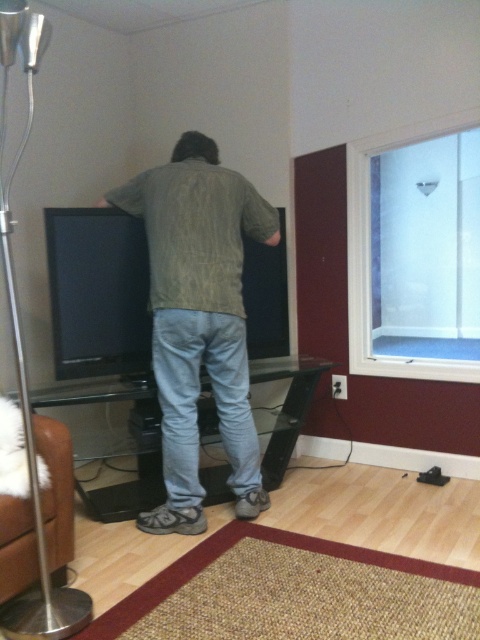
Can you confirm if green textured shirt at center is smaller than clear glass window at upper right?

No, green textured shirt at center is not smaller than clear glass window at upper right.

Is green textured shirt at center to the right of clear glass window at upper right from the viewer's perspective?

Incorrect, green textured shirt at center is not on the right side of clear glass window at upper right.

Does point (202, 156) lie behind point (367, 145)?

No, it is not.

Find the location of a particular element. green textured shirt at center is located at coordinates (199, 320).